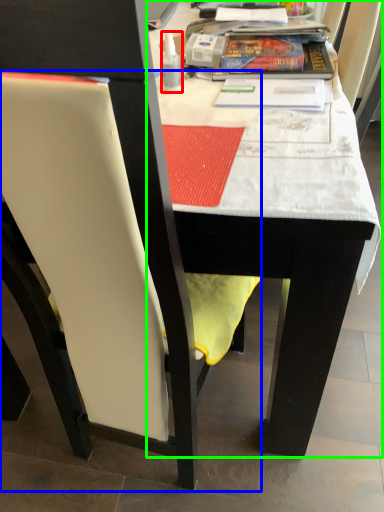
Question: Considering the real-world distances, which object is farthest from bottle (highlighted by a red box)? chair (highlighted by a blue box) or table (highlighted by a green box)?

Choices:
 (A) chair
 (B) table

Answer: (A)